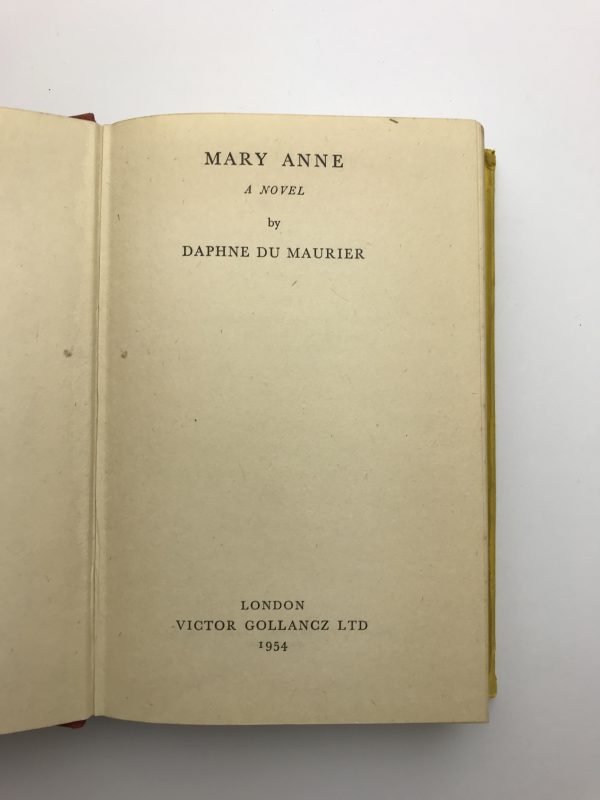
Find the location of a particular element. spine of book is located at coordinates (95, 350).